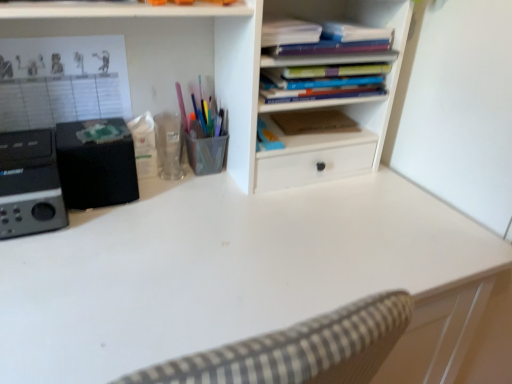
Where is `empty space that is ontop of brown matte paper at center (from a real-world perspective)`? This screenshot has height=384, width=512. empty space that is ontop of brown matte paper at center (from a real-world perspective) is located at coordinates (321, 121).